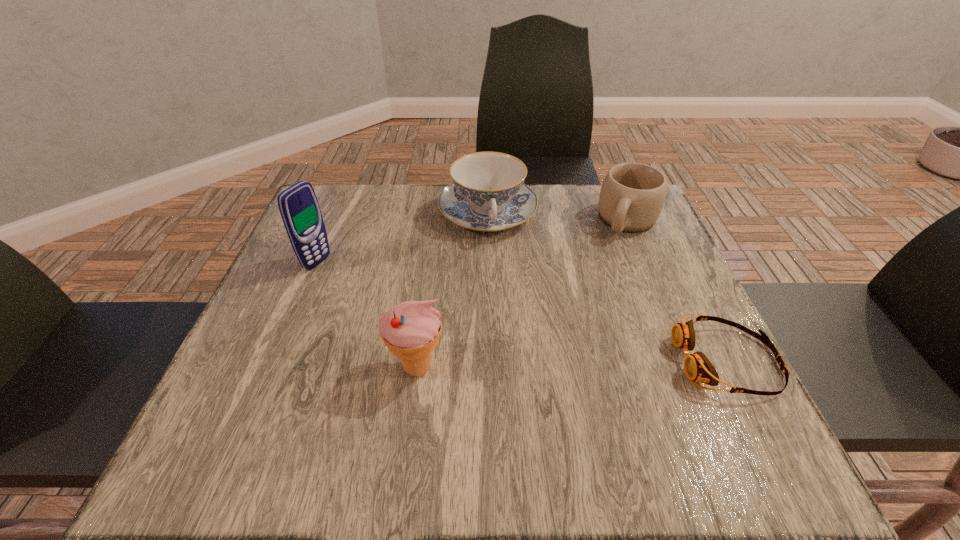
You are a GUI agent. You are given a task and a screenshot of the screen. Output one action in this format:
    pyautogui.click(x=<x>, y=<y>)
    Task: Click on the chinaware at the far edge
    This screenshot has width=960, height=540.
    Given the screenshot: What is the action you would take?
    pyautogui.click(x=488, y=193)

What are the coordinates of `icecream that is at the near edge` in the screenshot? It's located at (x=411, y=330).

Locate an element on the screen. The width and height of the screenshot is (960, 540). goggles present at the near edge is located at coordinates (697, 367).

Locate an element on the screen. This screenshot has height=540, width=960. object that is positioned at the left edge is located at coordinates (298, 205).

At what (x,y) coordinates should I click in order to perform the action: click on goggles that is at the right edge. Please return your answer as a coordinate pair (x, y). Looking at the image, I should click on (697, 367).

Image resolution: width=960 pixels, height=540 pixels. Identify the location of mug present at the right edge. (632, 195).

At what (x,y) coordinates should I click in order to perform the action: click on object that is at the far right corner. Please return your answer as a coordinate pair (x, y). Looking at the image, I should click on (632, 195).

At what (x,y) coordinates should I click in order to perform the action: click on object at the near right corner. Please return your answer as a coordinate pair (x, y). Looking at the image, I should click on (697, 367).

In the image, there is a desktop. Where is `free space at the far edge`? The image size is (960, 540). free space at the far edge is located at coordinates pyautogui.click(x=546, y=186).

Identify the location of vacant space at the near edge of the desktop. (405, 381).